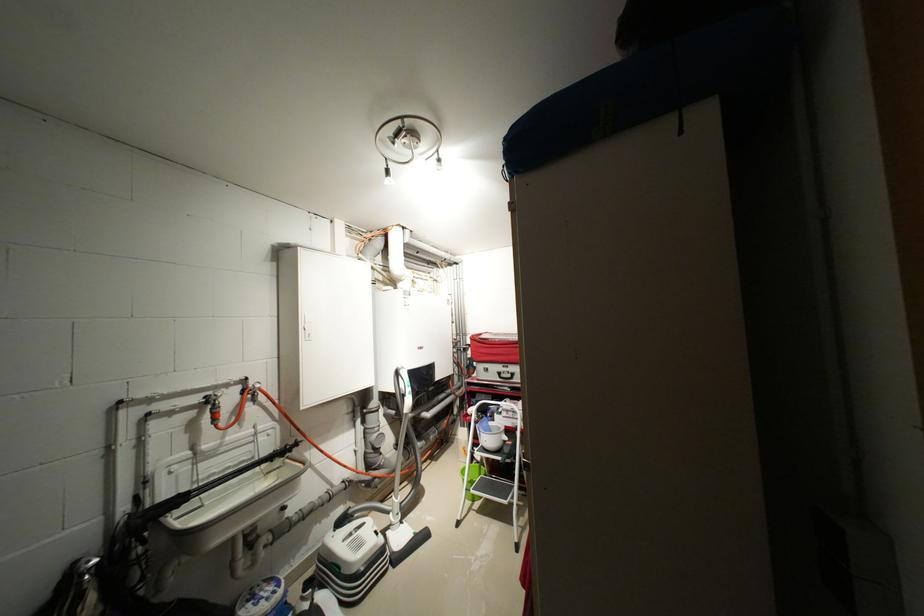
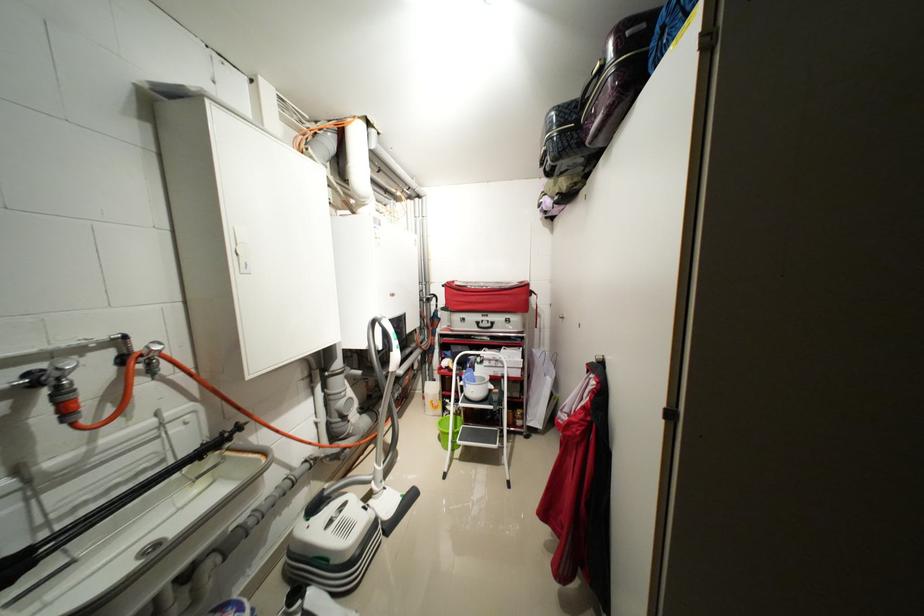
Find the pixel in the second image that matches pixel 216 394 in the first image.

(46, 367)